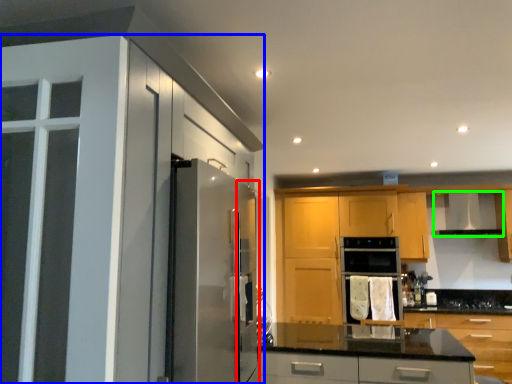
Question: Estimate the real-world distances between objects in this image. Which object is farther from screen door (highlighted by a red box), cabinetry (highlighted by a blue box) or exhaust hood (highlighted by a green box)?

Choices:
 (A) cabinetry
 (B) exhaust hood

Answer: (B)